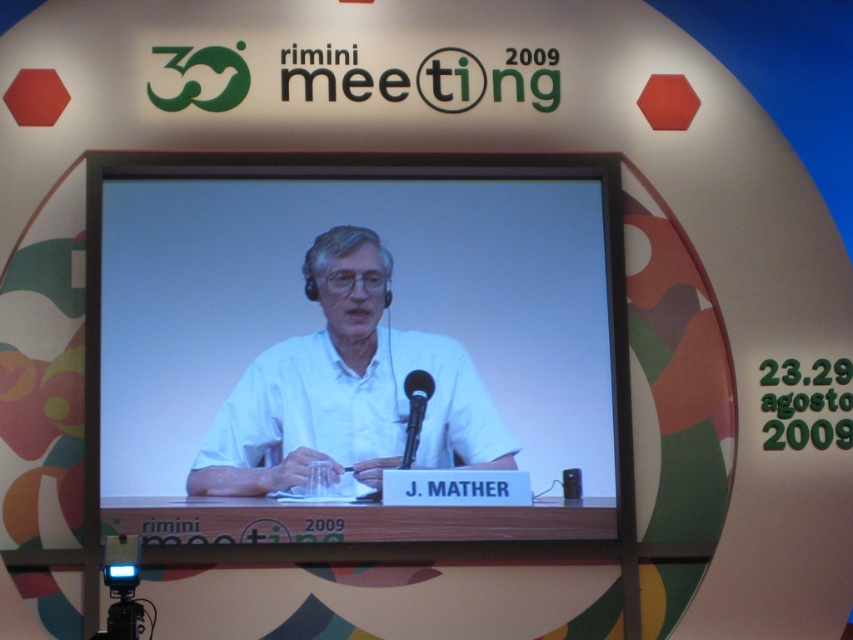
Question: Observing the image, what is the correct spatial positioning of white matte shirt at center in reference to black metallic microphone at center?

Choices:
 (A) below
 (B) above

Answer: (A)

Question: Does white matte shirt at center appear on the left side of black metallic microphone at center?

Choices:
 (A) yes
 (B) no

Answer: (A)

Question: Which point is farther to the camera?

Choices:
 (A) white matte shirt at center
 (B) black metallic microphone at center

Answer: (B)

Question: Can you confirm if white matte shirt at center is thinner than black metallic microphone at center?

Choices:
 (A) yes
 (B) no

Answer: (B)

Question: Which point appears farthest from the camera in this image?

Choices:
 (A) (432, 452)
 (B) (418, 394)

Answer: (B)